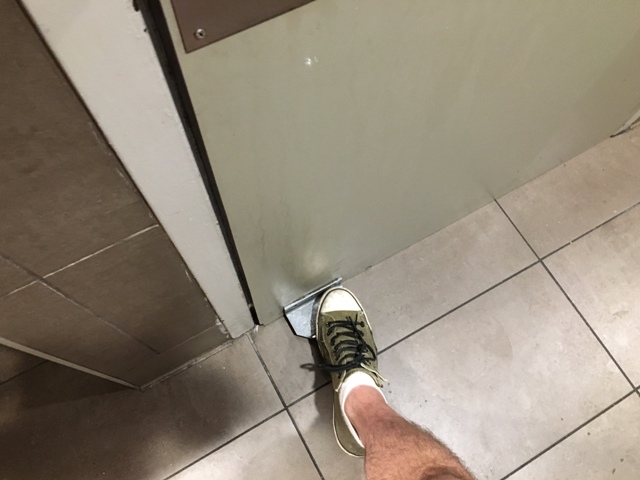
The width and height of the screenshot is (640, 480). Find the location of `wall`. wall is located at coordinates (116, 267).